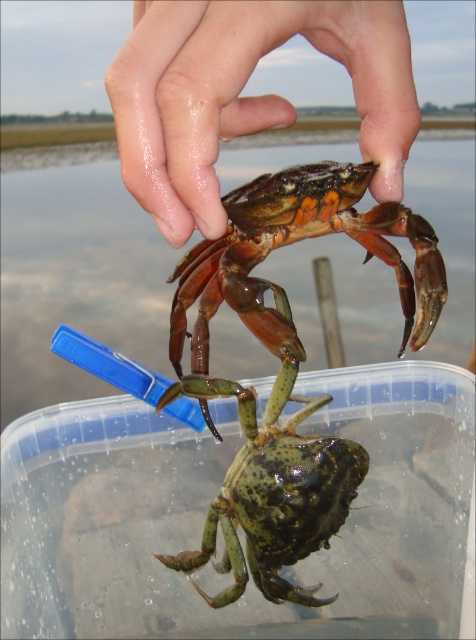
You are taking a photo of the scene and want to focus on both point [386,189] and point [281,346]. Which point should you adjust your focus to prioritize to ensure both are in focus?

Point [386,189] is closer to the camera than point [281,346]. To ensure both are in focus, you should focus on point [386,189] since it is closer, allowing the depth of field to extend to the farther point.